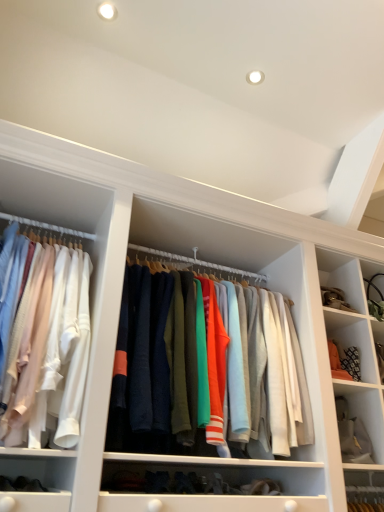
Question: Can you confirm if white fabric at lower right is wider than matte white shirts at left, acting as the first clothing starting from the left?

Choices:
 (A) yes
 (B) no

Answer: (B)

Question: Can you confirm if white fabric at lower right is bigger than matte white shirts at left, acting as the first clothing starting from the left?

Choices:
 (A) no
 (B) yes

Answer: (A)

Question: From the image's perspective, is white fabric at lower right under matte white shirts at left, acting as the first clothing starting from the left?

Choices:
 (A) no
 (B) yes

Answer: (B)

Question: Can you confirm if white fabric at lower right is taller than matte white shirts at left, which is counted as the second clothing, starting from the right?

Choices:
 (A) no
 (B) yes

Answer: (A)

Question: Is white fabric at lower right far from matte white shirts at left, which is counted as the second clothing, starting from the right?

Choices:
 (A) yes
 (B) no

Answer: (A)

Question: Is white fabric at lower right inside or outside of matte white shirts at left, acting as the first clothing starting from the left?

Choices:
 (A) outside
 (B) inside

Answer: (A)

Question: From the image's perspective, is white fabric at lower right above or below matte white shirts at left, acting as the first clothing starting from the left?

Choices:
 (A) above
 (B) below

Answer: (B)

Question: Considering the positions of point (375, 442) and point (79, 292), is point (375, 442) closer or farther from the camera than point (79, 292)?

Choices:
 (A) closer
 (B) farther

Answer: (B)

Question: In the image, is white fabric at lower right positioned in front of or behind matte white shirts at left, which is counted as the second clothing, starting from the right?

Choices:
 (A) front
 (B) behind

Answer: (B)

Question: Considering the positions of matte white shirts at left, acting as the first clothing starting from the left, and white fabric at lower right in the image, is matte white shirts at left, acting as the first clothing starting from the left, wider or thinner than white fabric at lower right?

Choices:
 (A) wide
 (B) thin

Answer: (A)

Question: Considering the positions of matte white shirts at left, which is counted as the second clothing, starting from the right, and white fabric at lower right in the image, is matte white shirts at left, which is counted as the second clothing, starting from the right, bigger or smaller than white fabric at lower right?

Choices:
 (A) small
 (B) big

Answer: (B)

Question: Is matte white shirts at left, which is counted as the second clothing, starting from the right, in front of or behind white fabric at lower right in the image?

Choices:
 (A) behind
 (B) front

Answer: (B)

Question: From their relative heights in the image, would you say matte white shirts at left, which is counted as the second clothing, starting from the right, is taller or shorter than white fabric at lower right?

Choices:
 (A) tall
 (B) short

Answer: (A)

Question: Is point (253, 352) positioned closer to the camera than point (36, 312)?

Choices:
 (A) farther
 (B) closer

Answer: (A)

Question: Is knit sweater at center, which is the 1th clothing from right to left, situated inside matte white shirts at left, acting as the first clothing starting from the left, or outside?

Choices:
 (A) inside
 (B) outside

Answer: (B)